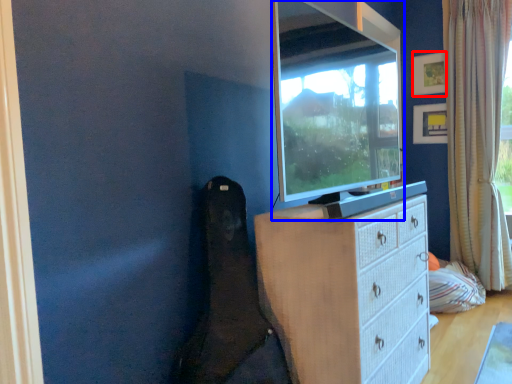
Question: Which of the following is the closest to the observer, picture frame (highlighted by a red box) or television (highlighted by a blue box)?

Choices:
 (A) picture frame
 (B) television

Answer: (B)